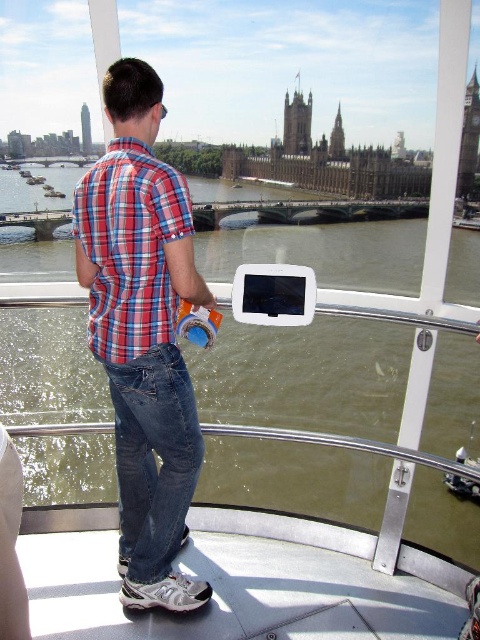
Question: Based on their relative distances, which object is nearer to the red plaid shirt at center?

Choices:
 (A) plaid cotton shirt at center
 (B) greenish water at center

Answer: (A)

Question: Is plaid cotton shirt at center to the left of red plaid shirt at center from the viewer's perspective?

Choices:
 (A) no
 (B) yes

Answer: (A)

Question: Which point is closer to the camera?

Choices:
 (A) plaid cotton shirt at center
 (B) red plaid shirt at center

Answer: (A)

Question: Based on their relative distances, which object is farther from the plaid cotton shirt at center?

Choices:
 (A) red plaid shirt at center
 (B) greenish water at center

Answer: (B)

Question: Can you confirm if greenish water at center is thinner than red plaid shirt at center?

Choices:
 (A) no
 (B) yes

Answer: (A)

Question: Is plaid cotton shirt at center closer to camera compared to red plaid shirt at center?

Choices:
 (A) no
 (B) yes

Answer: (B)